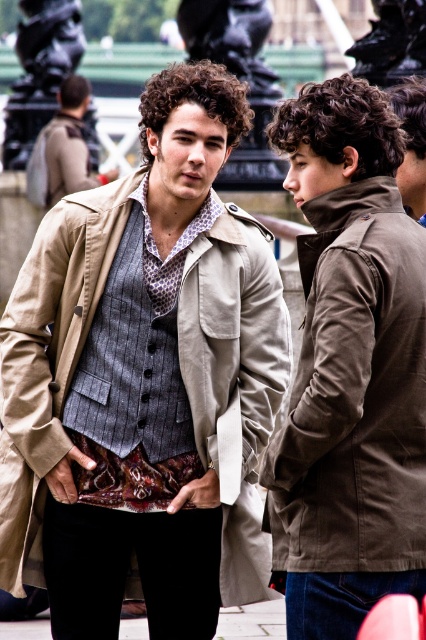
Can you confirm if beige fabric coat at center is taller than matte brown jacket at center?

Yes, beige fabric coat at center is taller than matte brown jacket at center.

Is point (28, 557) less distant than point (69, 125)?

Yes, point (28, 557) is closer to viewer.

In order to click on beige fabric coat at center in this screenshot , I will do `click(235, 380)`.

Can you confirm if matte brown jacket at right is positioned to the left of beige fabric coat at center?

Incorrect, matte brown jacket at right is not on the left side of beige fabric coat at center.

Locate an element on the screen. This screenshot has width=426, height=640. matte brown jacket at right is located at coordinates [x=350, y=371].

Consider the image. Does matte brown jacket at right have a greater width compared to matte brown jacket at center?

Yes, matte brown jacket at right is wider than matte brown jacket at center.

Can you confirm if matte brown jacket at right is positioned to the right of matte brown jacket at center?

Indeed, matte brown jacket at right is positioned on the right side of matte brown jacket at center.

Which is behind, point (360, 100) or point (63, 116)?

Positioned behind is point (63, 116).

Where is `matte brown jacket at right`? matte brown jacket at right is located at coordinates (350, 371).